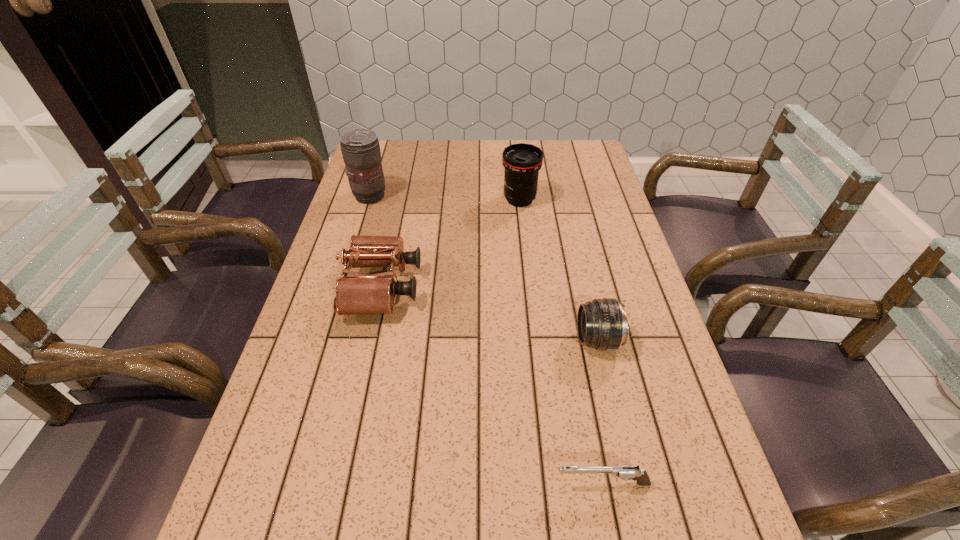
Locate an element on the screen. The image size is (960, 540). the tallest object is located at coordinates (360, 148).

I want to click on the leftmost telephoto lens, so click(x=360, y=148).

This screenshot has height=540, width=960. I want to click on the second tallest object, so click(522, 162).

Where is `the second telephoto lens from left to right`? The image size is (960, 540). the second telephoto lens from left to right is located at coordinates (522, 162).

Where is `binoculars`? Image resolution: width=960 pixels, height=540 pixels. binoculars is located at coordinates (361, 294).

Find the location of `the rightmost telephoto lens`. the rightmost telephoto lens is located at coordinates (602, 324).

This screenshot has width=960, height=540. Identify the location of the nearest telephoto lens. (602, 324).

Where is `the shortest object`? The height and width of the screenshot is (540, 960). the shortest object is located at coordinates (625, 472).

Identify the location of pistol. (625, 472).

The width and height of the screenshot is (960, 540). In order to click on free space located on the side of the leftmost telephoto lens where the control switches are located in this screenshot , I will do `click(502, 196)`.